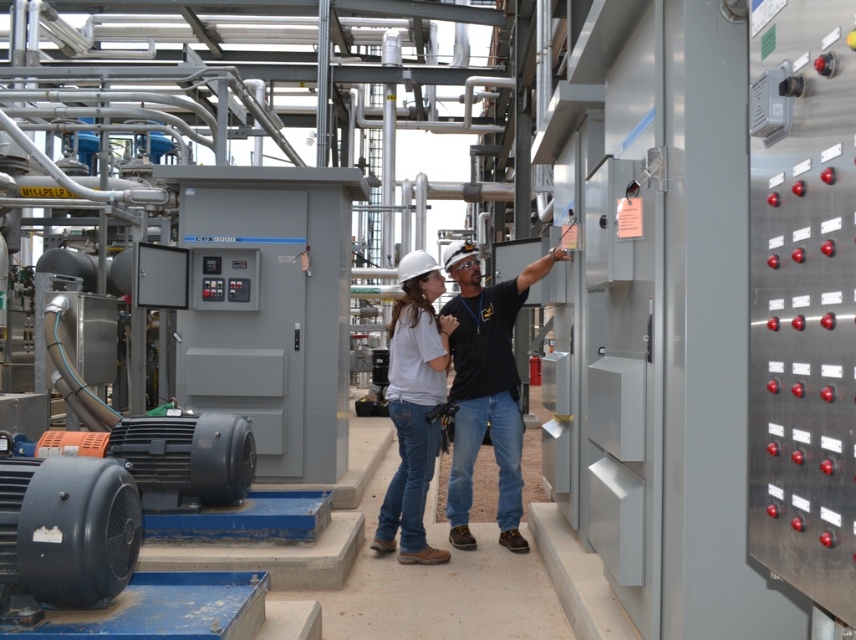
You are an inspector in the industrial facility. You need to locate the worker wearing the matte black shirt at center. Where should you look relative to the white matte helmet at center?

The matte black shirt at center is to the right of the white matte helmet at center, so you should look to the right side of the white matte helmet at center to find the worker wearing the matte black shirt at center.